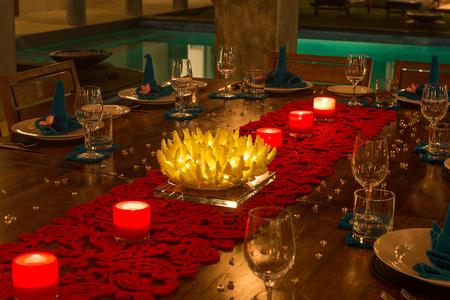
The height and width of the screenshot is (300, 450). Identify the location of water glass. (374, 211), (442, 136), (385, 95), (245, 86), (194, 96), (111, 137).